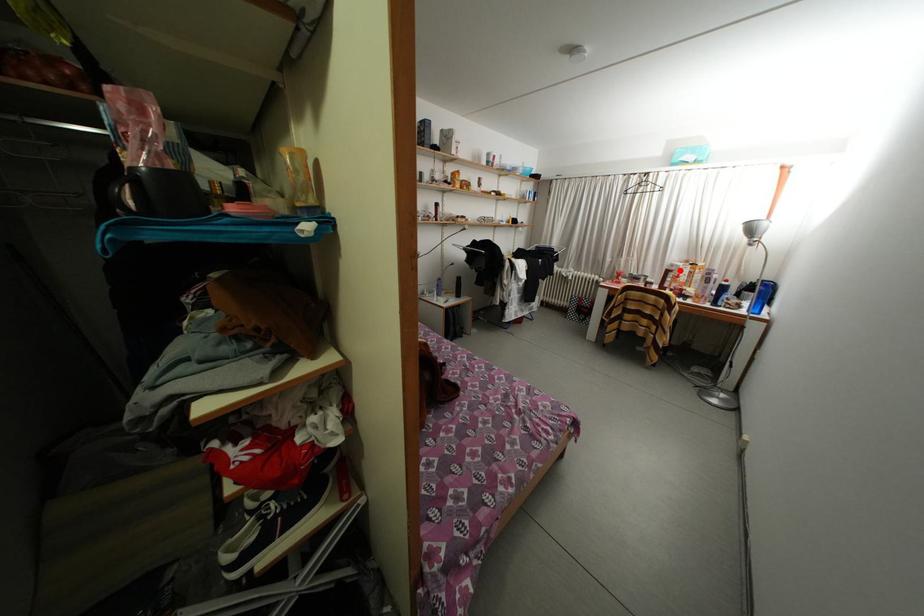
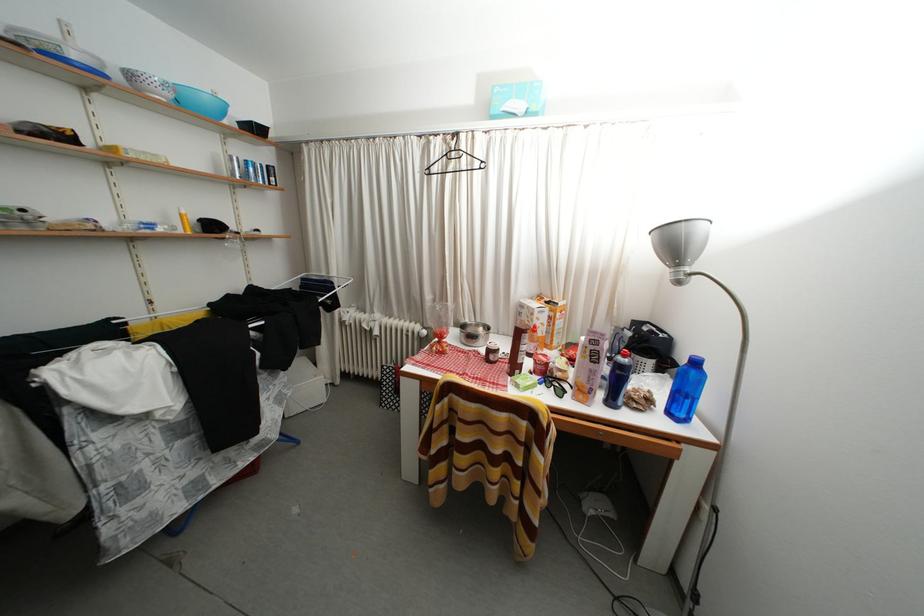
Question: I am providing you with two images of the same scene from different viewpoints. Image1 has a red point marked. In image2, the corresponding 3D location appears at what relative position? Reply with the corresponding letter.

Choices:
 (A) Closer
 (B) Farther

Answer: (B)